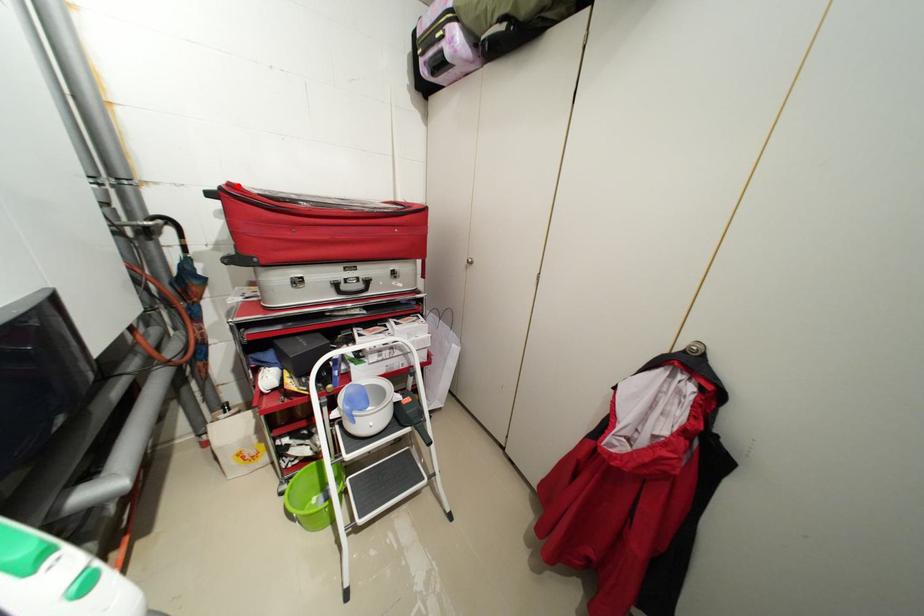
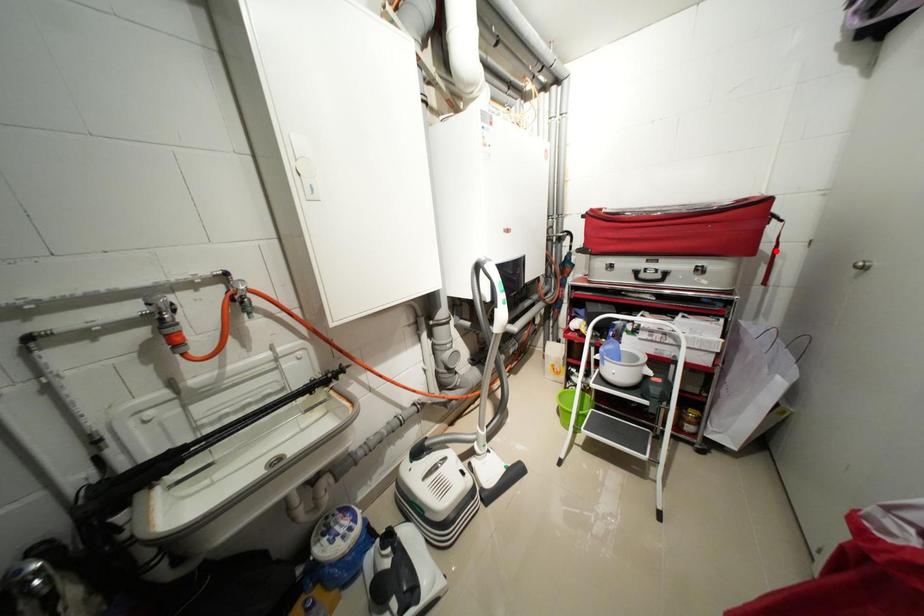
I am providing you with two images of the same scene from different viewpoints. A red point is marked on the first image and another point is marked on the second image. Does the point marked in image1 correspond to the same location as the one in image2?

No